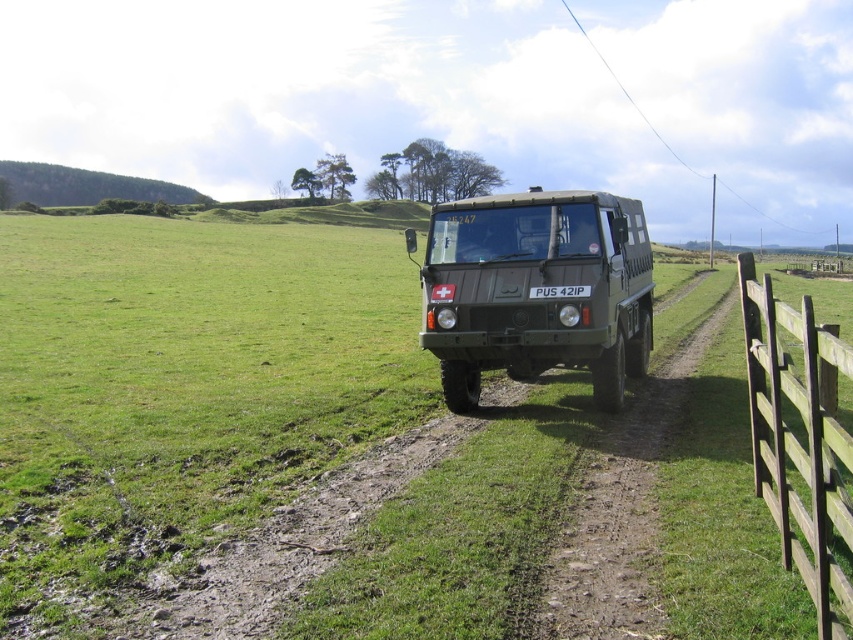
Question: Which of these objects is positioned farthest from the brown wooden fence at right?

Choices:
 (A) matte green truck at center
 (B) white plastic license plate at center

Answer: (B)

Question: Considering the relative positions of matte green truck at center and white plastic license plate at center in the image provided, where is matte green truck at center located with respect to white plastic license plate at center?

Choices:
 (A) right
 (B) left

Answer: (A)

Question: Which object is closer to the camera taking this photo?

Choices:
 (A) brown wooden fence at right
 (B) matte green truck at center
 (C) white plastic license plate at center

Answer: (A)

Question: Does matte green truck at center have a smaller size compared to white plastic license plate at center?

Choices:
 (A) yes
 (B) no

Answer: (B)

Question: Can you confirm if matte green truck at center is positioned to the right of white plastic license plate at center?

Choices:
 (A) yes
 (B) no

Answer: (A)

Question: Which point is farther to the camera?

Choices:
 (A) (578, 289)
 (B) (761, 285)
 (C) (618, 200)

Answer: (C)